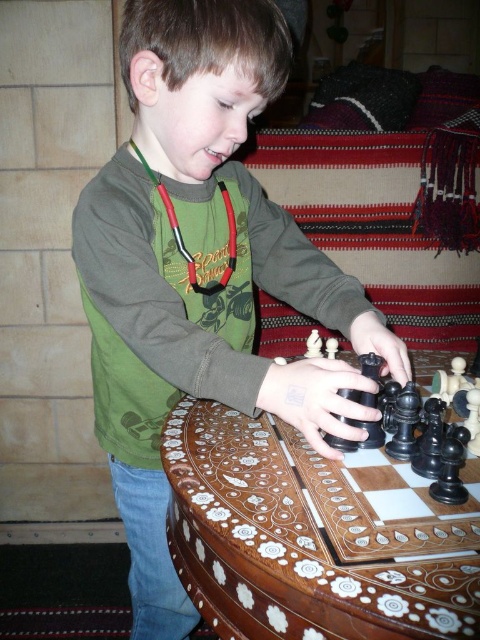
The boy wants to place the black glossy chess piece at center closer to the inlaid wood chessboard at center. How much distance does he need to move it to make them touch?

The black glossy chess piece at center is currently 3.74 centimeters away from the inlaid wood chessboard at center. To make them touch, the boy needs to move it 3.74 centimeters closer.

You are a photographer trying to capture the boy in a way that shows both his focused expression and the intricate chessboard design. Since the green matte shirt at center and the inlaid wood chessboard at center are both at the center, which one is closer to the camera?

The green matte shirt at center is positioned over the inlaid wood chessboard at center, so the green matte shirt at center is closer to the camera.